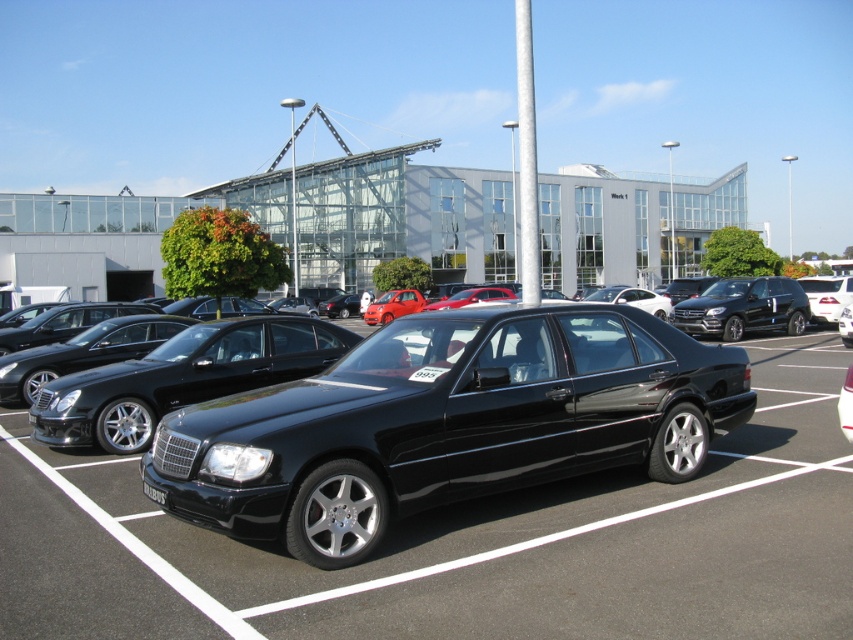
You are a delivery person needing to park your van between the glossy black car at center and the black metallic sedan at right. The van requires a minimum of 20 feet of space. Can you fit your van between them?

The distance between the glossy black car at center and the black metallic sedan at right is 42.33 feet, which is more than enough to accommodate the van requiring 20 feet of space.